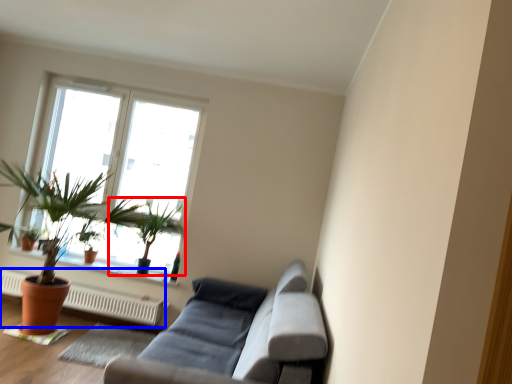
Question: Which of the following is the farthest to the observer, houseplant (highlighted by a red box) or heater (highlighted by a blue box)?

Choices:
 (A) houseplant
 (B) heater

Answer: (A)